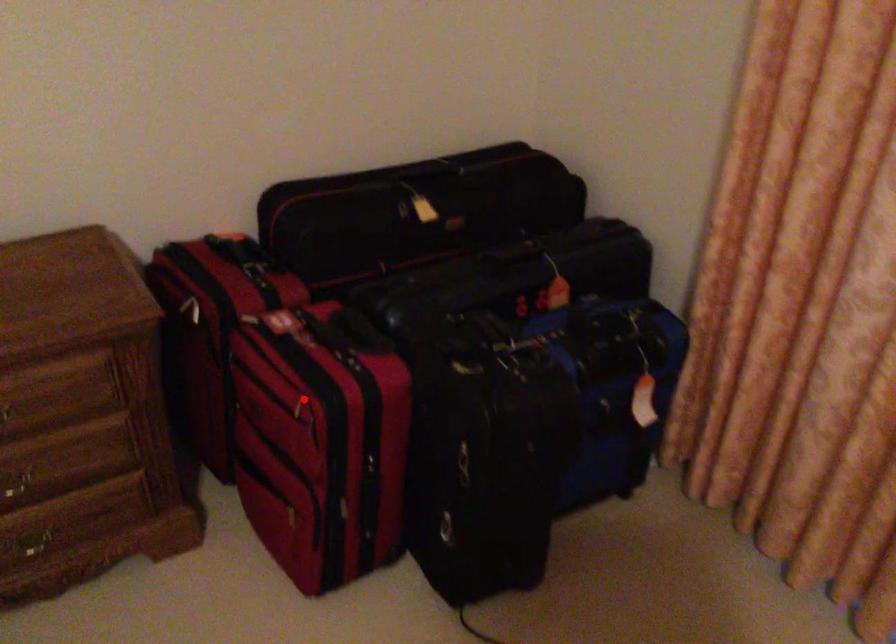
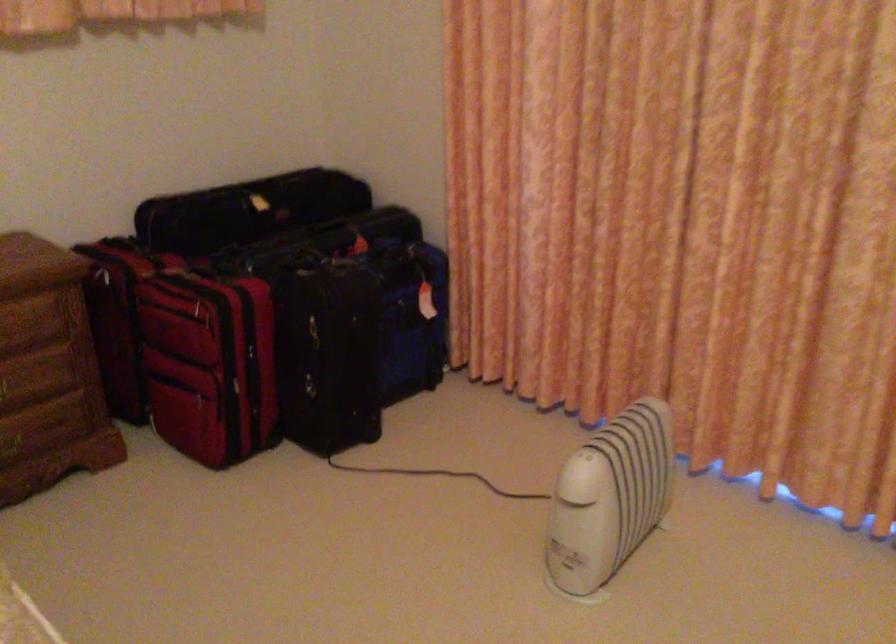
Question: I am providing you with two images of the same scene from different viewpoints. In image1, a red point is highlighted. Considering the same 3D point in image2, which of the following is correct?

Choices:
 (A) It is closer
 (B) It is farther

Answer: (B)